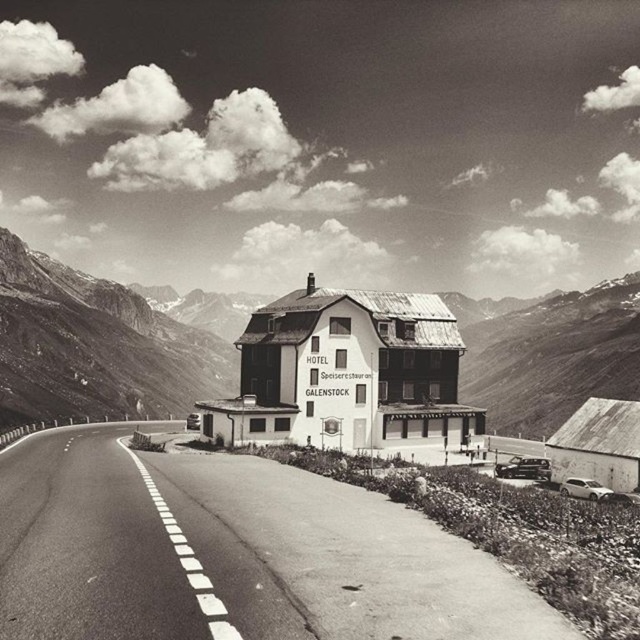
Question: Which point is closer to the camera?

Choices:
 (A) (288, 545)
 (B) (224, 392)

Answer: (A)

Question: Does asphalt road at center have a lesser width compared to rugged stone mountain at center?

Choices:
 (A) no
 (B) yes

Answer: (B)

Question: Does asphalt road at center have a greater width compared to rugged stone mountain at center?

Choices:
 (A) no
 (B) yes

Answer: (A)

Question: Which point is closer to the camera?

Choices:
 (A) (563, 380)
 (B) (83, 458)

Answer: (B)

Question: Where is asphalt road at center located in relation to rugged stone mountain at center in the image?

Choices:
 (A) right
 (B) left

Answer: (B)